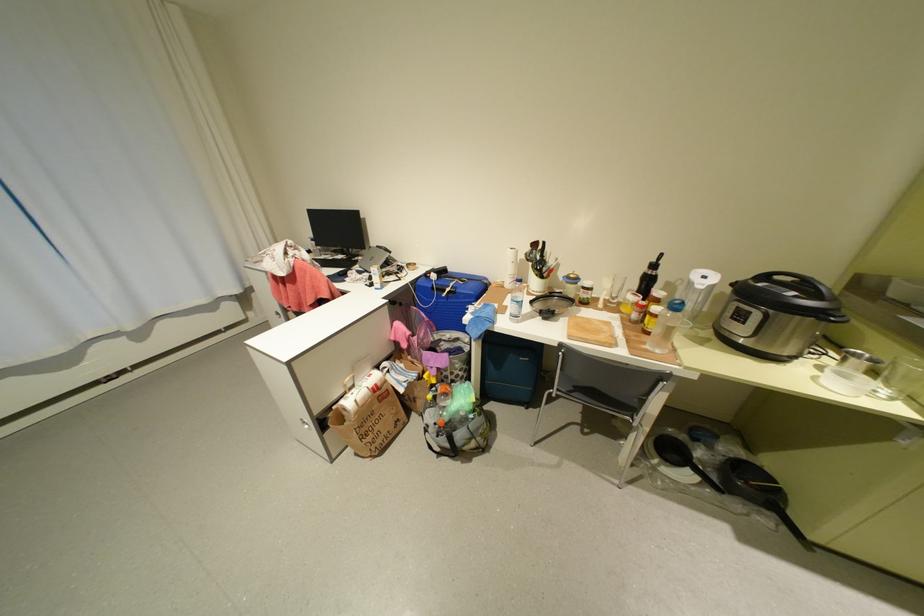
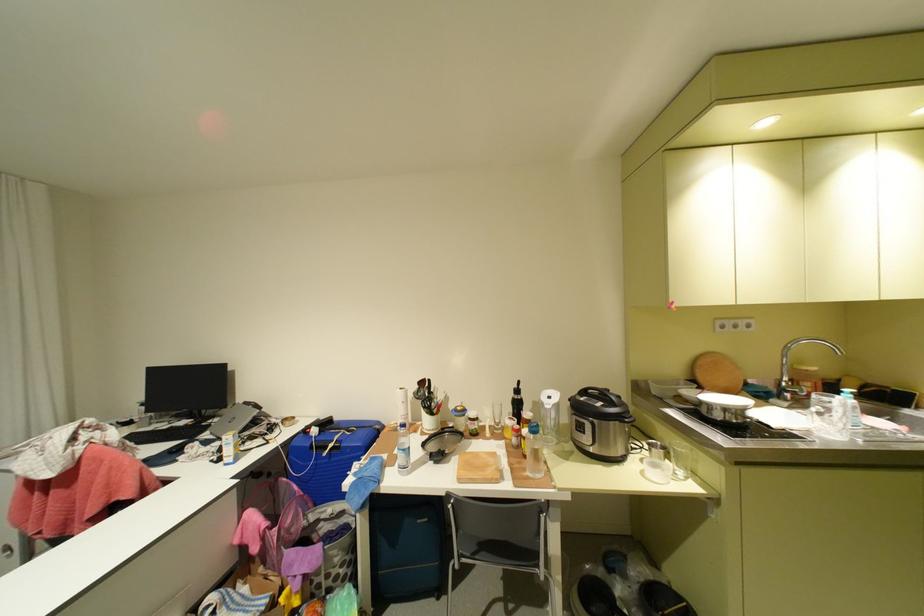
Based on the continuous images, in which direction is the camera rotating?

The camera's rotation is toward right-up.